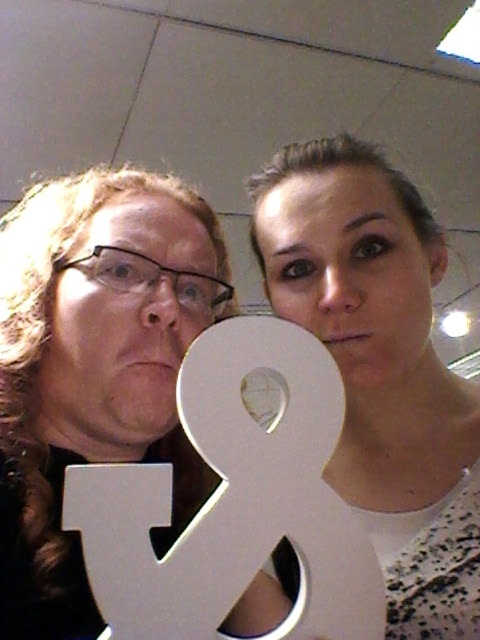
Who is taller, metallic gold number at center or white matte letter at center?

metallic gold number at center is taller.

Is metallic gold number at center behind white matte letter at center?

Yes.

Does point (186, 248) come closer to viewer compared to point (199, 528)?

No, (186, 248) is further to viewer.

Where is `metallic gold number at center`? This screenshot has width=480, height=640. metallic gold number at center is located at coordinates (94, 365).

Does point (137, 340) come in front of point (324, 269)?

Yes, point (137, 340) is closer to viewer.

Is point (144, 225) more distant than point (453, 570)?

Yes, it is.

Identify the location of metallic gold number at center. The image size is (480, 640). (94, 365).

Is point (452, 460) less distant than point (300, 529)?

No, (452, 460) is behind (300, 529).

Is white matte sign at center shorter than white matte letter at center?

No.

The image size is (480, 640). Identify the location of white matte sign at center. (381, 365).